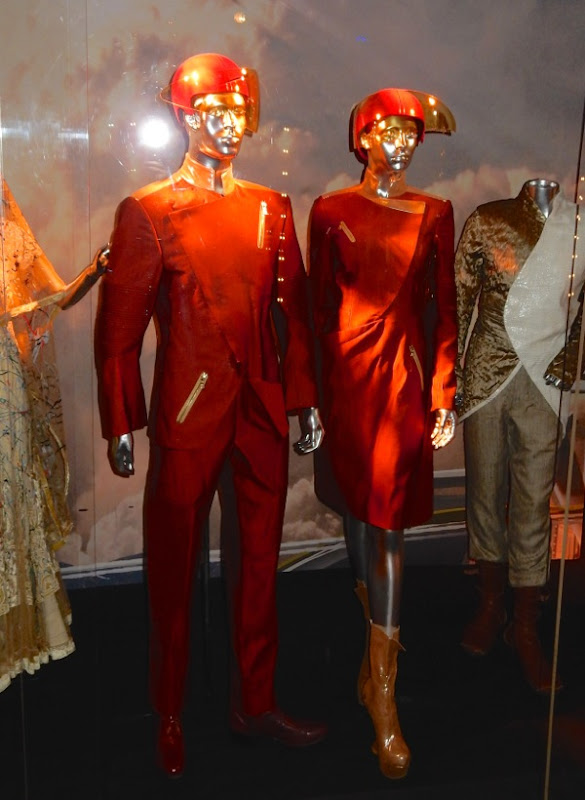
Locate an element on the screen. Image resolution: width=585 pixels, height=800 pixels. statue 1 is located at coordinates (219, 317).